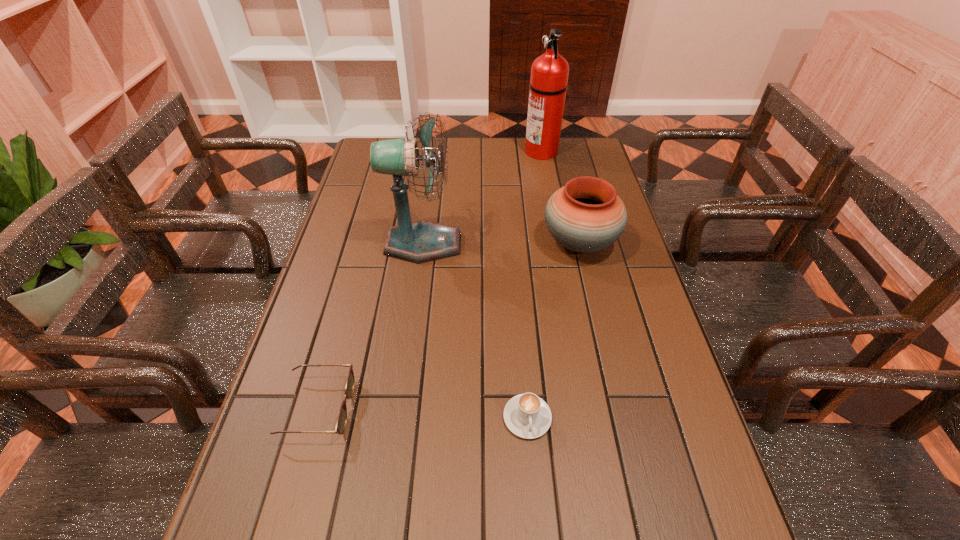
This screenshot has width=960, height=540. I want to click on free space located to the right of the third object from right to left, so pyautogui.click(x=536, y=529).

Find the location of a particular element. This screenshot has width=960, height=540. blank space located at the front view of the spectacles is located at coordinates (453, 408).

Where is `object at the far edge`? The image size is (960, 540). object at the far edge is located at coordinates 549,73.

Where is `fan that is at the left edge`? The width and height of the screenshot is (960, 540). fan that is at the left edge is located at coordinates (422, 241).

The width and height of the screenshot is (960, 540). In order to click on spectacles situated at the left edge in this screenshot , I will do `click(341, 422)`.

This screenshot has width=960, height=540. I want to click on fire extinguisher present at the right edge, so click(x=549, y=73).

At what (x,y) coordinates should I click in order to perform the action: click on pottery that is at the right edge. Please return your answer as a coordinate pair (x, y). The width and height of the screenshot is (960, 540). Looking at the image, I should click on (586, 215).

This screenshot has height=540, width=960. I want to click on object present at the far right corner, so click(x=549, y=73).

What are the coordinates of `free point at the left edge` in the screenshot? It's located at (377, 179).

This screenshot has height=540, width=960. Identify the location of vacant space at the right edge of the desktop. (674, 513).